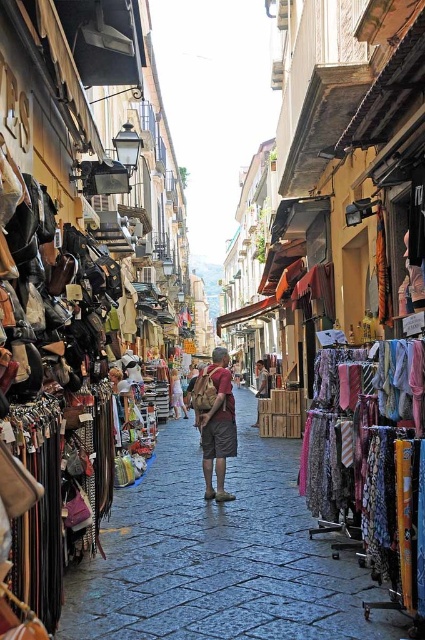
Is dark stone pavement at center closer to the viewer compared to light brown leather backpack at center?

Yes, it is in front of light brown leather backpack at center.

Is point (229, 621) behind point (263, 376)?

No, (229, 621) is in front of (263, 376).

Is point (193, 589) closer to camera compared to point (263, 380)?

That is True.

Locate an element on the screen. This screenshot has height=640, width=425. dark stone pavement at center is located at coordinates (220, 556).

Is brown leather backpack at center to the right of denim shorts at center from the viewer's perspective?

Correct, you'll find brown leather backpack at center to the right of denim shorts at center.

Based on the photo, which of these two, brown leather backpack at center or denim shorts at center, stands taller?

Standing taller between the two is brown leather backpack at center.

Image resolution: width=425 pixels, height=640 pixels. What are the coordinates of `brown leather backpack at center` in the screenshot? It's located at (215, 420).

Locate an element on the screen. brown leather backpack at center is located at coordinates (215, 420).

Is brown leather backpack at center thinner than light brown leather backpack at center?

Yes.

Describe the element at coordinates (215, 420) in the screenshot. I see `brown leather backpack at center` at that location.

Find the location of a particular element. This screenshot has height=640, width=425. brown leather backpack at center is located at coordinates (215, 420).